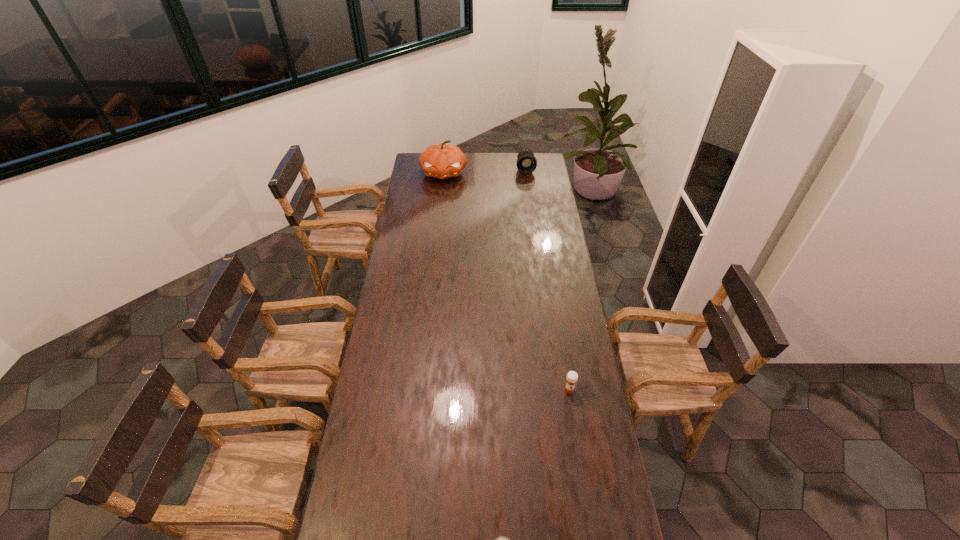
This screenshot has width=960, height=540. I want to click on the leftmost object, so click(442, 161).

This screenshot has height=540, width=960. Identify the location of the tallest object. (442, 161).

Where is `the third shortest object`? the third shortest object is located at coordinates (526, 163).

Image resolution: width=960 pixels, height=540 pixels. In order to click on the farther medicine in this screenshot , I will do `click(572, 377)`.

Locate an element on the screen. the second nearest object is located at coordinates (572, 377).

Where is `vacant space located on the front face of the pumpkin`? This screenshot has width=960, height=540. vacant space located on the front face of the pumpkin is located at coordinates (442, 197).

In order to click on free spot located at the front element of the telephoto lens in this screenshot , I will do `click(529, 195)`.

The image size is (960, 540). Identify the location of vacant region located on the label side of the second nearest object. (581, 465).

You are a GUI agent. You are given a task and a screenshot of the screen. Output one action in this format:
    pyautogui.click(x=<x>, y=<y>)
    Task: Click on the pumpkin at the far edge
    This screenshot has height=540, width=960.
    Given the screenshot: What is the action you would take?
    pyautogui.click(x=442, y=161)

The width and height of the screenshot is (960, 540). Identify the location of telephoto lens that is at the far edge. (526, 163).